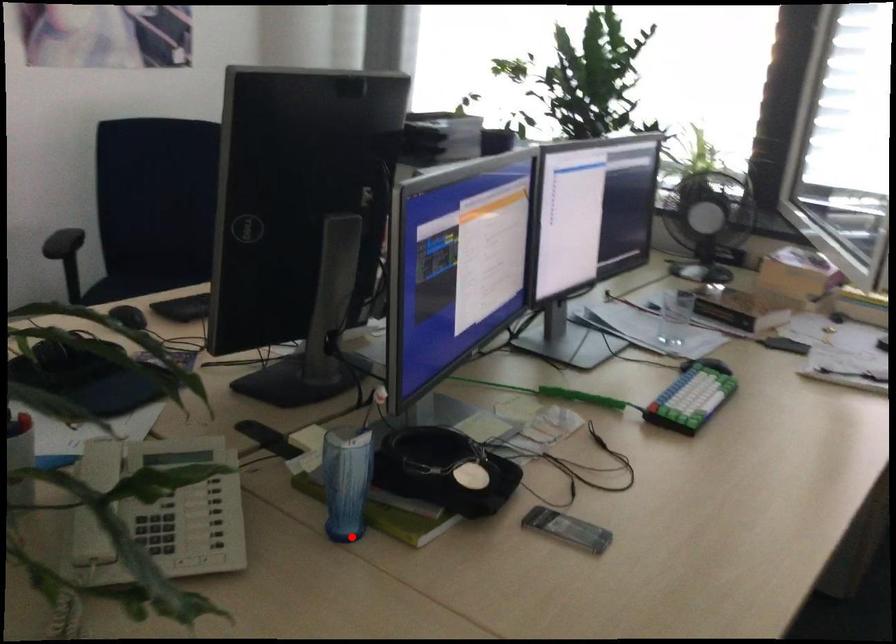
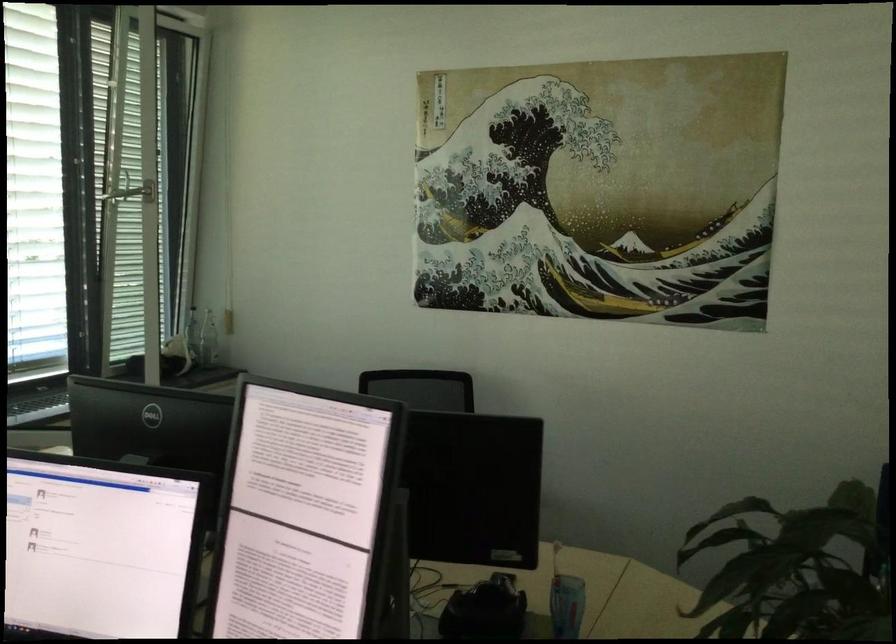
Where in the second image is the point corresponding to the highlighted location from the first image?

(566, 605)